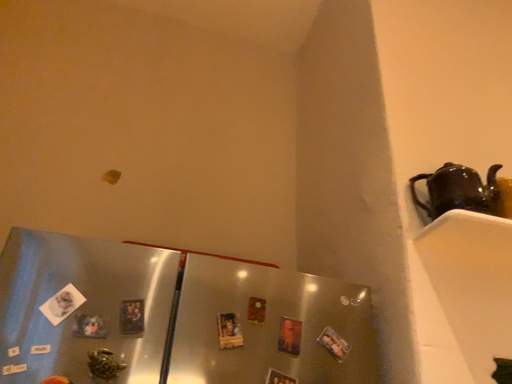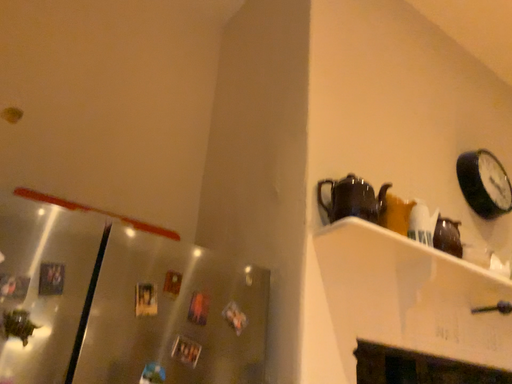
Question: How did the camera likely rotate when shooting the video?

Choices:
 (A) rotated left
 (B) rotated right

Answer: (B)